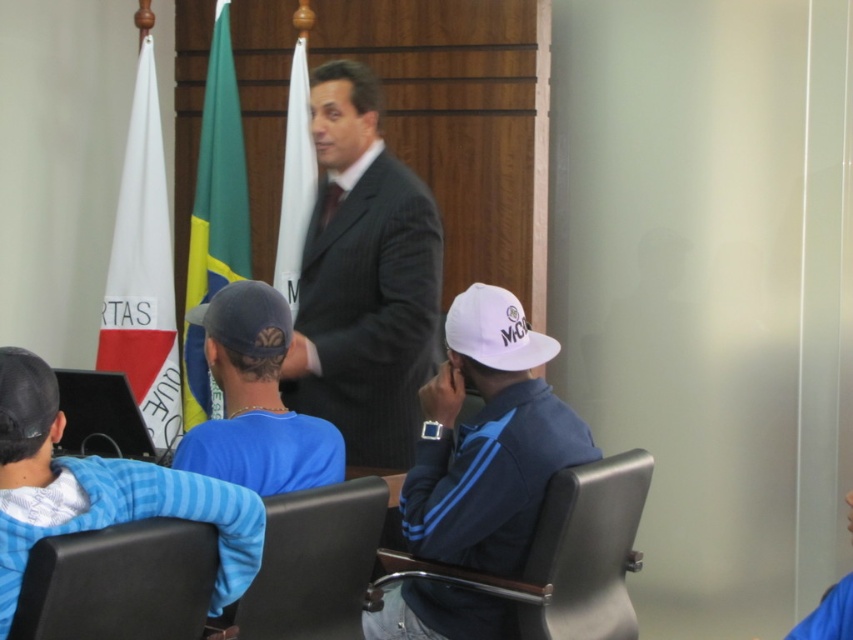
From the picture: Is dark gray pinstripe suit at center bigger than black leather chair at lower center?

Yes, dark gray pinstripe suit at center is bigger than black leather chair at lower center.

Is dark gray pinstripe suit at center to the left of black leather chair at lower center from the viewer's perspective?

No, dark gray pinstripe suit at center is not to the left of black leather chair at lower center.

Which is in front, point (349, 108) or point (291, 508)?

Point (291, 508) is in front.

Locate an element on the screen. dark gray pinstripe suit at center is located at coordinates (364, 280).

Does blue striped shirt at lower left have a smaller size compared to white fabric flag at left?

Yes, blue striped shirt at lower left is smaller than white fabric flag at left.

Can you confirm if blue striped shirt at lower left is bigger than white fabric flag at left?

No.

The height and width of the screenshot is (640, 853). Find the location of `blue striped shirt at lower left`. blue striped shirt at lower left is located at coordinates (99, 490).

What are the coordinates of `blue striped shirt at lower left` in the screenshot? It's located at (99, 490).

Who is positioned more to the right, dark gray pinstripe suit at center or white fabric flag at center?

From the viewer's perspective, dark gray pinstripe suit at center appears more on the right side.

Between dark gray pinstripe suit at center and white fabric flag at center, which one has more height?

With more height is dark gray pinstripe suit at center.

Does point (314, 134) come closer to viewer compared to point (308, 134)?

That is True.

Locate an element on the screen. The image size is (853, 640). dark gray pinstripe suit at center is located at coordinates (364, 280).